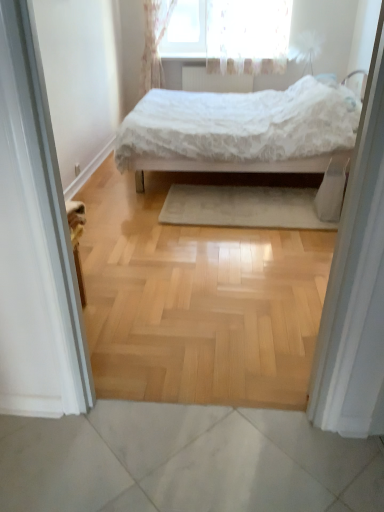
Question: Considering their positions, is white fabric screen door at right, positioned as the first screen door in right-to-left order, located in front of or behind white lace curtain at upper center?

Choices:
 (A) front
 (B) behind

Answer: (A)

Question: Is white fabric screen door at right, acting as the 2th screen door starting from the left, inside or outside of white lace curtain at upper center?

Choices:
 (A) outside
 (B) inside

Answer: (A)

Question: Which object is the closest to the beige soft rug at center?

Choices:
 (A) white lace bed at center
 (B) white fabric screen door at left, the 2th screen door positioned from the right
 (C) white fabric screen door at right, acting as the 2th screen door starting from the left
 (D) white lace curtain at upper center
 (E) white textured radiator at upper center

Answer: (A)

Question: Which is nearer to the transparent floral curtain at upper center?

Choices:
 (A) white lace curtain at upper center
 (B) white lace bed at center
 (C) beige soft rug at center
 (D) white fabric screen door at right, acting as the 2th screen door starting from the left
 (E) white fabric screen door at left, the 1th screen door from the left

Answer: (A)